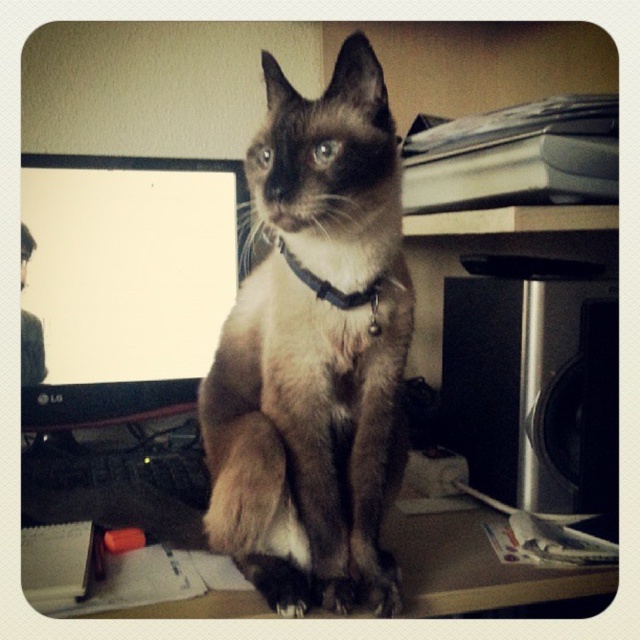
Which is above, matte black monitor at left or black leather collar at center?

matte black monitor at left is higher up.

Is matte black monitor at left smaller than black leather collar at center?

Actually, matte black monitor at left might be larger than black leather collar at center.

Is point (193, 356) positioned before point (328, 294)?

No, (193, 356) is behind (328, 294).

In order to click on matte black monitor at left in this screenshot , I will do `click(124, 282)`.

Who is lower down, matte black monitor at left or brown wooden table at lower center?

brown wooden table at lower center

Does point (163, 380) lie in front of point (33, 515)?

No, (163, 380) is further to viewer.

The height and width of the screenshot is (640, 640). Find the location of `matte black monitor at left`. matte black monitor at left is located at coordinates (124, 282).

Between smokey brown fur at center and black leather collar at center, which one is positioned lower?

Positioned lower is smokey brown fur at center.

Can you confirm if smokey brown fur at center is taller than black leather collar at center?

Yes, smokey brown fur at center is taller than black leather collar at center.

Between point (227, 531) and point (298, 275), which one is positioned in front?

Point (227, 531) is more forward.

Locate an element on the screen. smokey brown fur at center is located at coordinates (314, 352).